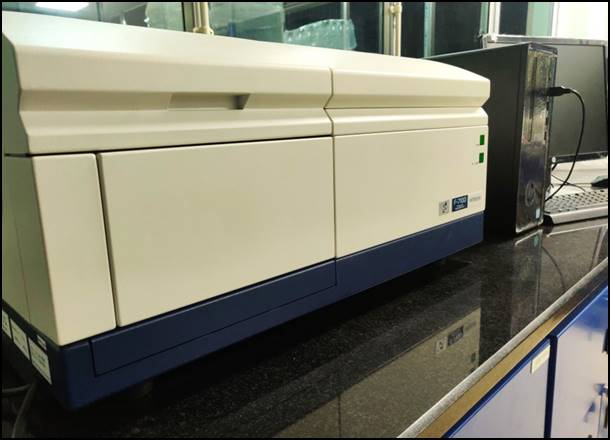
You are a GUI agent. You are given a task and a screenshot of the screen. Output one action in this format:
    pyautogui.click(x=<x>, y=<y>)
    Task: Click on the wall
    The image size is (610, 440).
    Given the screenshot: What is the action you would take?
    pyautogui.click(x=576, y=24)